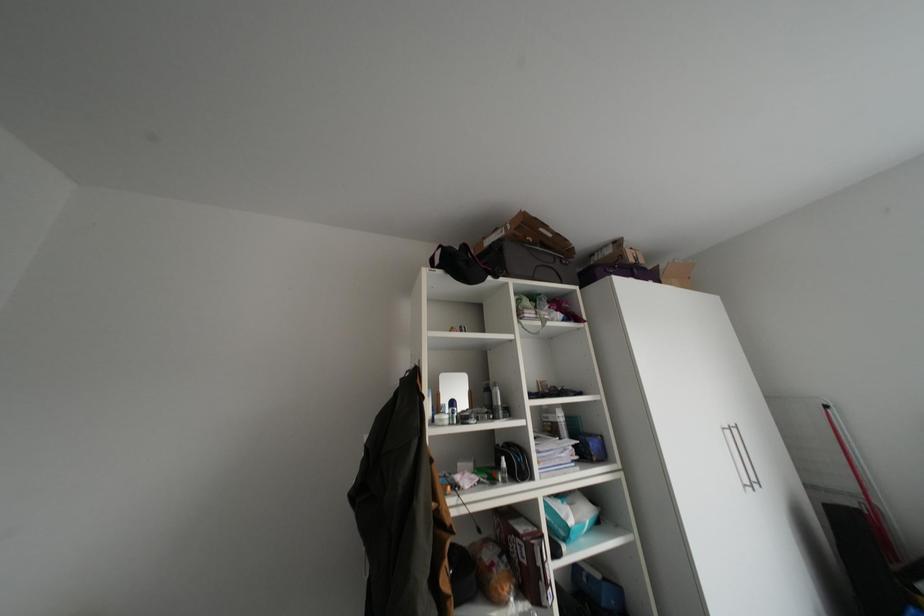
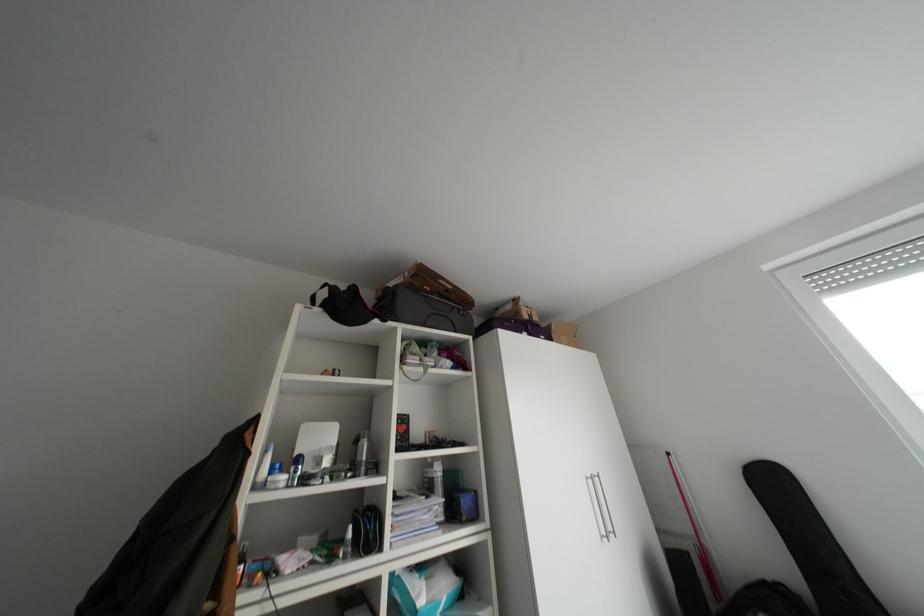
Question: The camera is either moving clockwise (left) or counter-clockwise (right) around the object. The first image is from the beginning of the video and the second image is from the end. Is the camera moving left or right when shooting the video?

Choices:
 (A) Left
 (B) Right

Answer: (A)